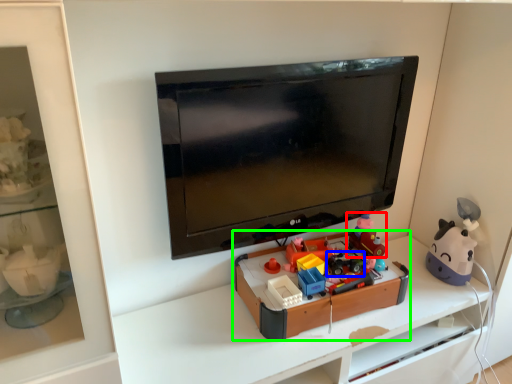
Question: Which object is positioned closest to toy (highlighted by a red box)? Select from toy (highlighted by a blue box) and toy (highlighted by a green box).

Choices:
 (A) toy
 (B) toy

Answer: (A)